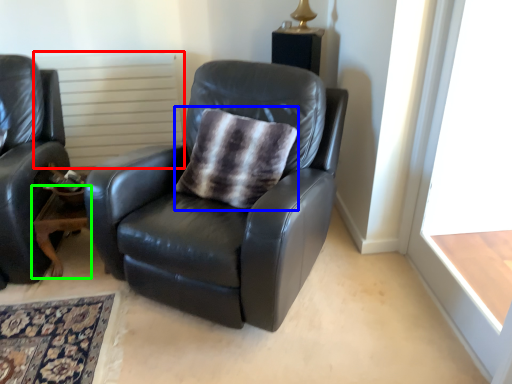
Question: Based on their relative distances, which object is nearer to radiator (highlighted by a red box)? Choose from throw pillow (highlighted by a blue box) and table (highlighted by a green box).

Choices:
 (A) throw pillow
 (B) table

Answer: (B)